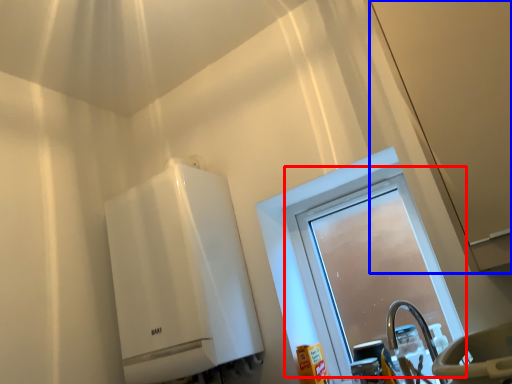
Question: Which point is further to the camera, window (highlighted by a red box) or screen door (highlighted by a blue box)?

Choices:
 (A) window
 (B) screen door

Answer: (A)